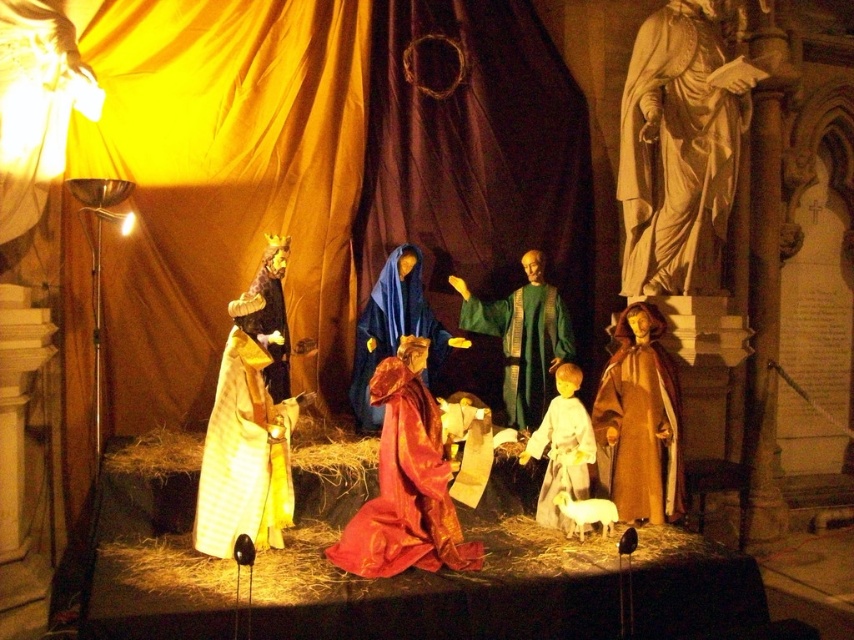
Can you confirm if gold textured fabric robe at left is positioned below brown matte robe at lower right?

Indeed, gold textured fabric robe at left is positioned under brown matte robe at lower right.

Does point (232, 516) come closer to viewer compared to point (626, 484)?

Yes, point (232, 516) is closer to viewer.

Locate an element on the screen. gold textured fabric robe at left is located at coordinates click(x=244, y=454).

Identify the location of gold textured fabric robe at left. (244, 454).

Between point (451, 538) and point (253, 419), which one is positioned behind?

The point (451, 538) is behind.

Describe the element at coordinates (405, 490) in the screenshot. This screenshot has width=854, height=640. I see `shiny red fabric at center` at that location.

What do you see at coordinates (405, 490) in the screenshot? I see `shiny red fabric at center` at bounding box center [405, 490].

At what (x,y) coordinates should I click in order to perform the action: click on shiny red fabric at center. Please return your answer as a coordinate pair (x, y). Image resolution: width=854 pixels, height=640 pixels. Looking at the image, I should click on (405, 490).

Is point (536, 328) behind point (572, 493)?

Yes, it is behind point (572, 493).

Which is in front, point (539, 332) or point (542, 513)?

Positioned in front is point (542, 513).

Where is `green matte robe at center`? green matte robe at center is located at coordinates (524, 344).